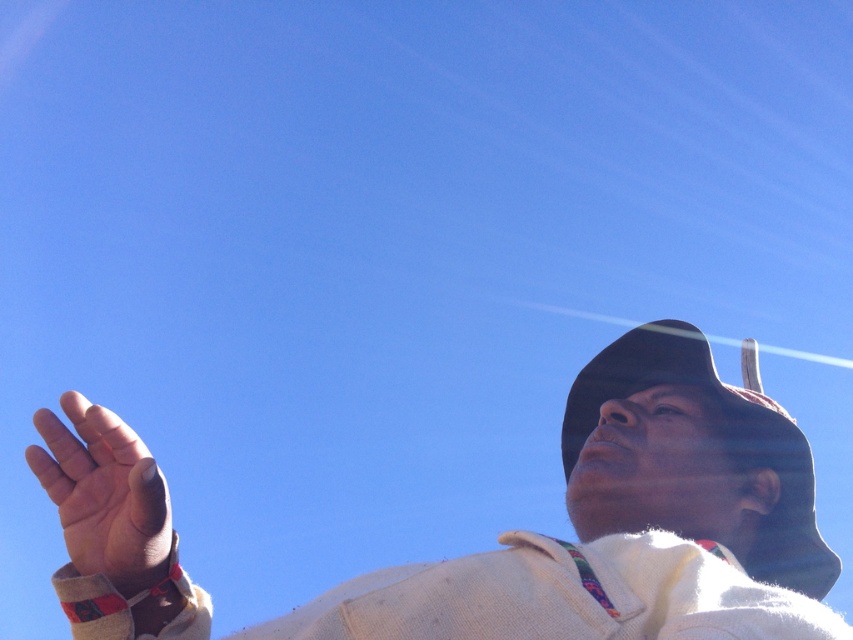
Question: Can you confirm if white knitted sweater at upper right is wider than brown felt cowboy hat at right?

Choices:
 (A) no
 (B) yes

Answer: (B)

Question: Based on their relative distances, which object is nearer to the brown felt cowboy hat at right?

Choices:
 (A) smooth skin hand at lower left
 (B) white knitted sweater at upper right

Answer: (B)

Question: Does brown felt cowboy hat at right appear on the right side of smooth skin hand at lower left?

Choices:
 (A) yes
 (B) no

Answer: (A)

Question: Is white knitted sweater at upper right behind smooth skin hand at lower left?

Choices:
 (A) yes
 (B) no

Answer: (B)

Question: Considering the real-world distances, which object is closest to the smooth skin hand at lower left?

Choices:
 (A) white knitted sweater at upper right
 (B) brown felt cowboy hat at right

Answer: (A)

Question: Which of the following is the farthest from the observer?

Choices:
 (A) (764, 404)
 (B) (119, 541)

Answer: (A)